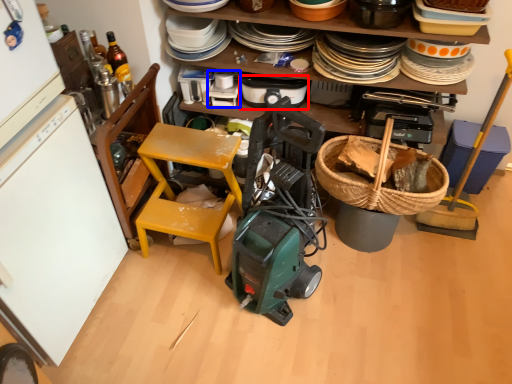
Question: Which object is further to the camera taking this photo, appliance (highlighted by a red box) or appliance (highlighted by a blue box)?

Choices:
 (A) appliance
 (B) appliance

Answer: (B)